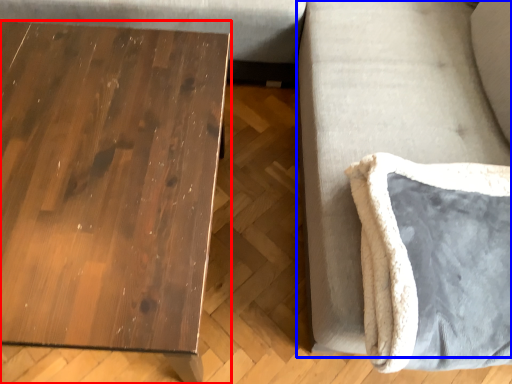
Question: Which object appears farthest to the camera in this image, table (highlighted by a red box) or couch (highlighted by a blue box)?

Choices:
 (A) table
 (B) couch

Answer: (A)